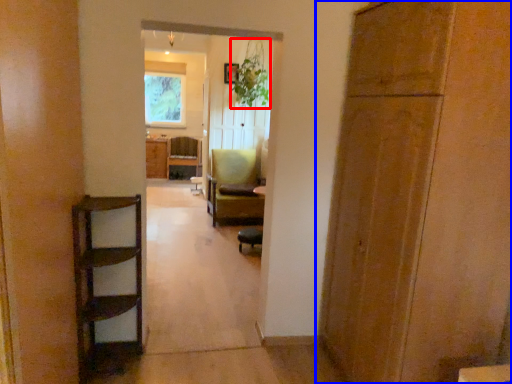
Question: Which of the following is the closest to the observer, plant (highlighted by a red box) or door (highlighted by a blue box)?

Choices:
 (A) plant
 (B) door

Answer: (B)